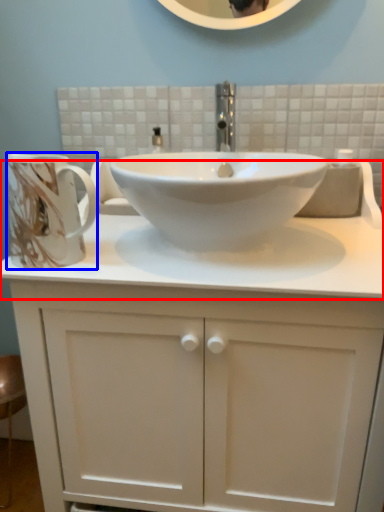
Question: Which point is further to the camera, counter top (highlighted by a red box) or mug (highlighted by a blue box)?

Choices:
 (A) counter top
 (B) mug

Answer: (B)